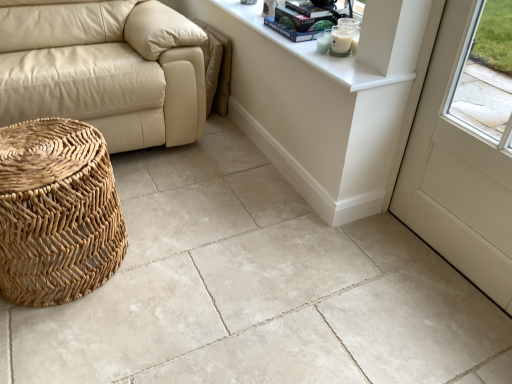
Identify the location of blank area to the left of white matte screen door at lower right. (369, 266).